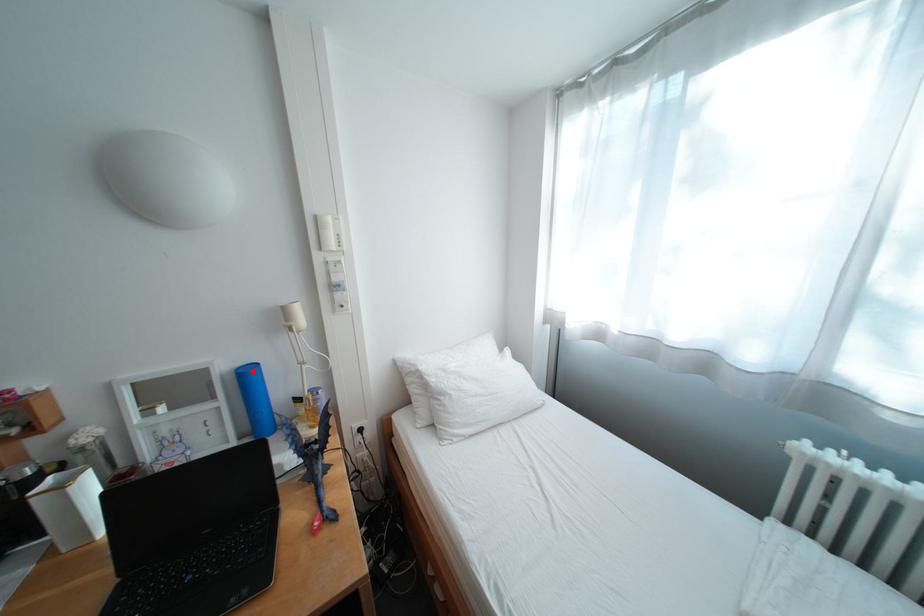
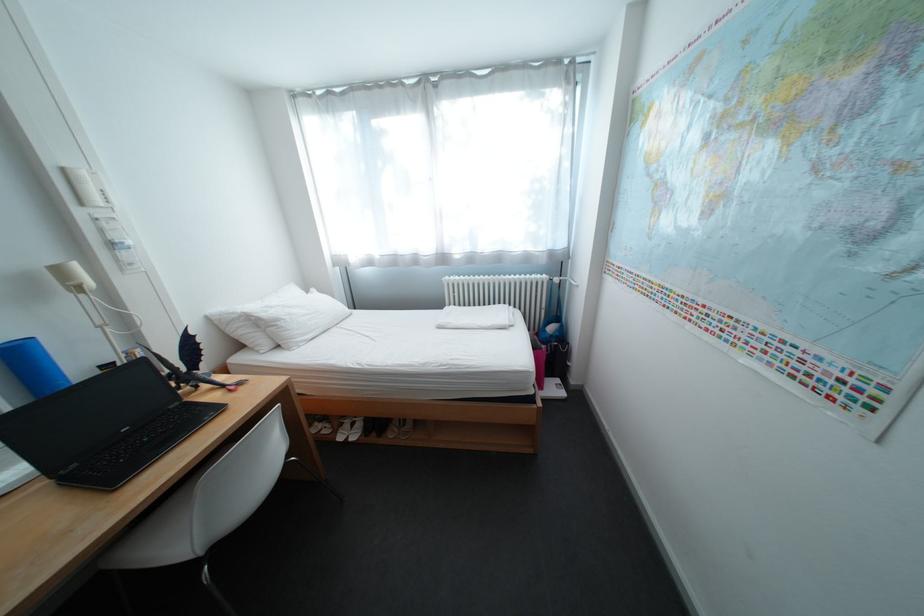
In the second image, find the point that corresponds to the highlighted location in the first image.

(17, 347)